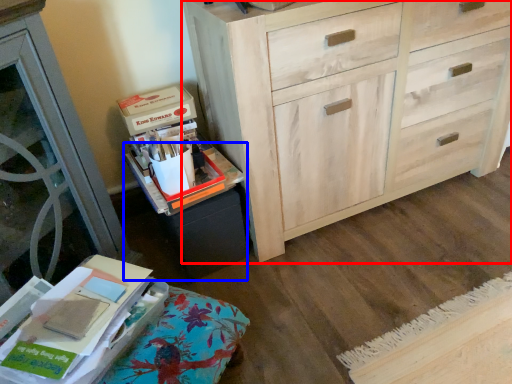
Question: Which object is further to the camera taking this photo, chest of drawers (highlighted by a red box) or cabinetry (highlighted by a blue box)?

Choices:
 (A) chest of drawers
 (B) cabinetry

Answer: (B)